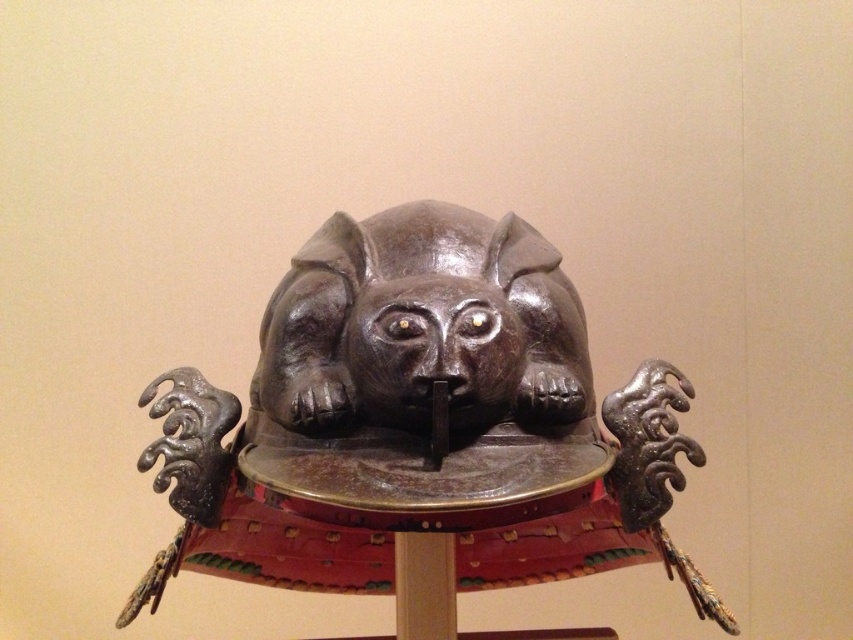
Question: Does shiny dark brown helmet at center have a smaller size compared to shiny brown helmet at center?

Choices:
 (A) no
 (B) yes

Answer: (A)

Question: Which point appears closest to the camera in this image?

Choices:
 (A) (450, 445)
 (B) (288, 346)

Answer: (A)

Question: Does shiny dark brown helmet at center appear under shiny brown helmet at center?

Choices:
 (A) yes
 (B) no

Answer: (A)

Question: Does shiny dark brown helmet at center have a smaller size compared to shiny brown helmet at center?

Choices:
 (A) yes
 (B) no

Answer: (B)